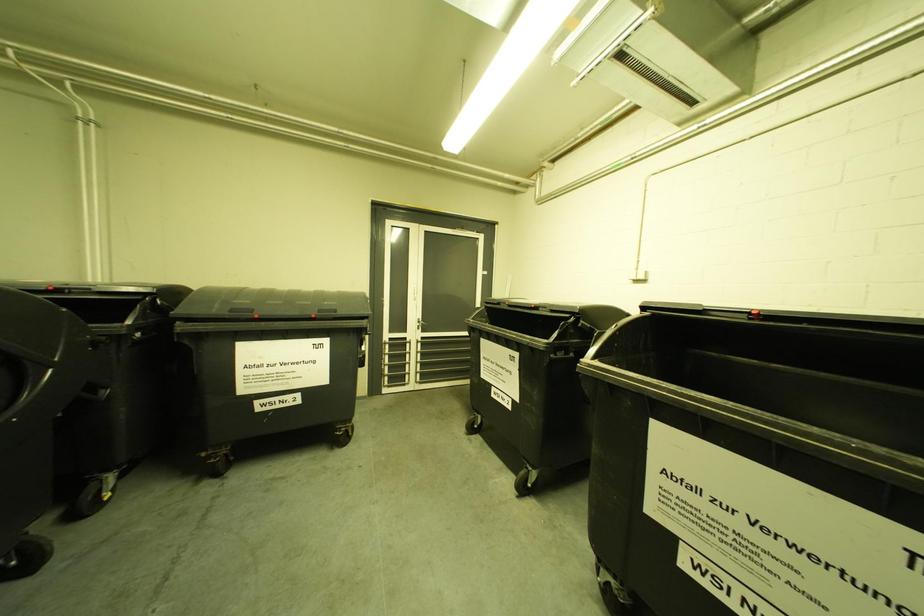
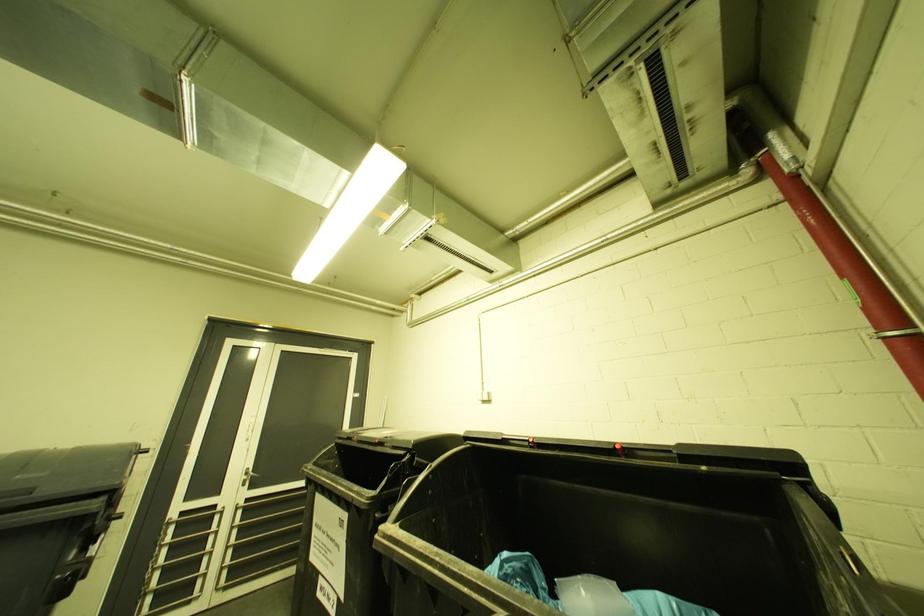
Based on the photo, the images are taken continuously from a first-person perspective. In which direction is your viewpoint rotating?

The rotation direction of the camera is right-up.